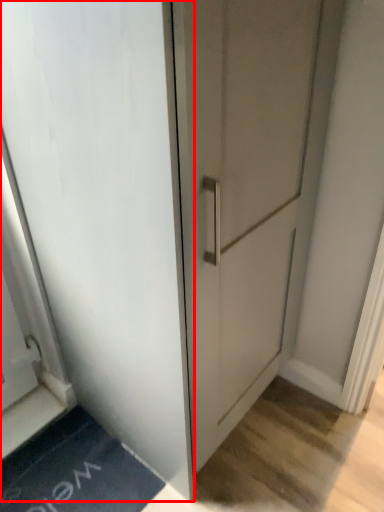
Question: From the image, what is the correct spatial relationship of door (annotated by the red box) in relation to bath mat?

Choices:
 (A) left
 (B) right

Answer: (B)